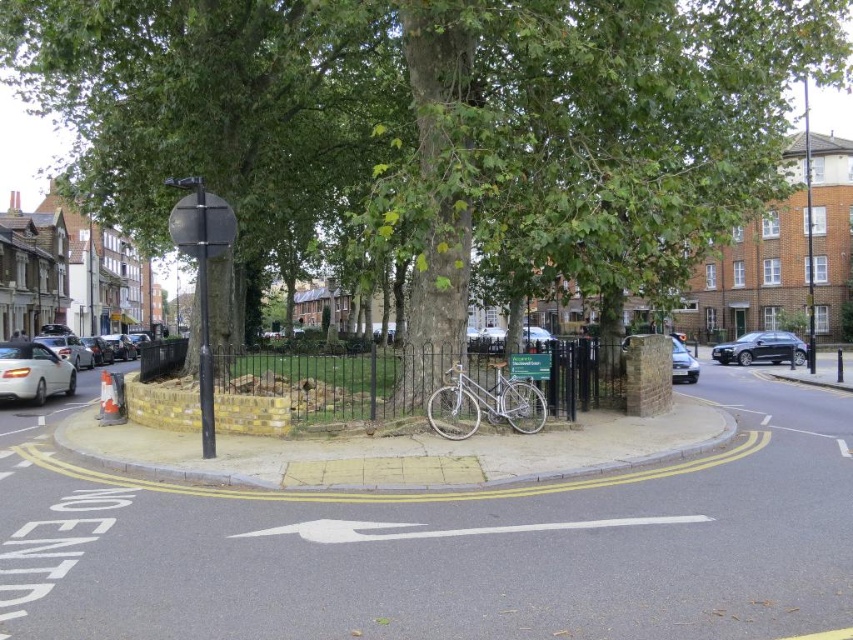
Can you confirm if silver metallic bicycle at center is bigger than metallic gray sedan at right?

Incorrect, silver metallic bicycle at center is not larger than metallic gray sedan at right.

Is point (445, 374) positioned after point (740, 356)?

No, it is not.

Locate an element on the screen. silver metallic bicycle at center is located at coordinates (485, 404).

In the scene shown: Can you confirm if green leafy tree at center is smaller than silver metallic car at left?

No, green leafy tree at center is not smaller than silver metallic car at left.

Who is shorter, green leafy tree at center or silver metallic car at left?

With less height is silver metallic car at left.

Locate an element on the screen. green leafy tree at center is located at coordinates (434, 128).

Can you confirm if white glossy car at left is bigger than metallic gray sedan at right?

Actually, white glossy car at left might be smaller than metallic gray sedan at right.

Does white glossy car at left have a lesser height compared to metallic gray sedan at right?

Yes, white glossy car at left is shorter than metallic gray sedan at right.

Is point (24, 390) positioned behind point (717, 349)?

That is False.

Identify the location of white glossy car at left. (33, 371).